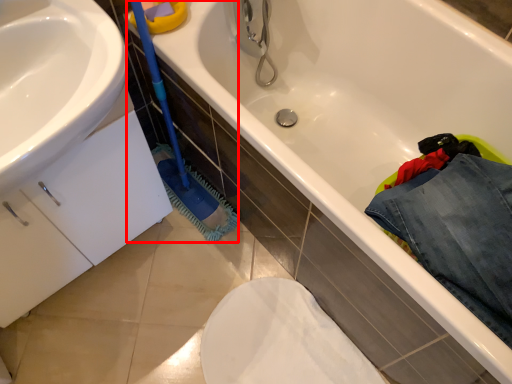
Question: From the image's perspective, what is the correct spatial positioning of brush (annotated by the red box) in reference to clothing?

Choices:
 (A) below
 (B) above

Answer: (B)